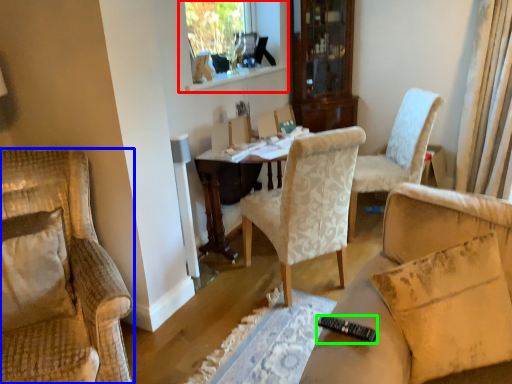
Question: Estimate the real-world distances between objects in this image. Which object is farther from window frame (highlighted by a red box), chair (highlighted by a blue box) or remote control (highlighted by a green box)?

Choices:
 (A) chair
 (B) remote control

Answer: (B)